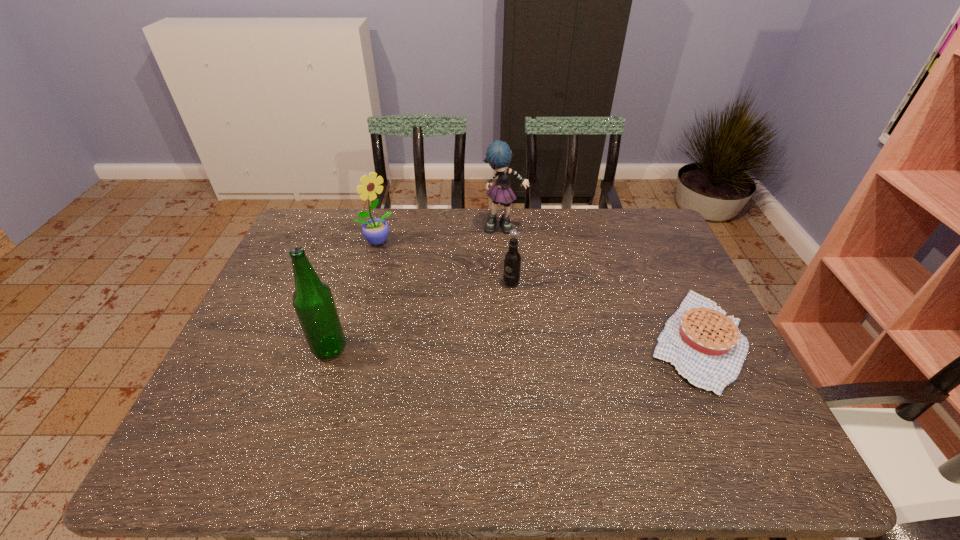
This screenshot has height=540, width=960. Find the location of `vacant space located 0.130m on the front-facing side of the rag doll`. vacant space located 0.130m on the front-facing side of the rag doll is located at coordinates (516, 261).

Find the location of a particular element. The image size is (960, 540). free region located on the front-facing side of the rag doll is located at coordinates (528, 302).

Locate an element on the screen. This screenshot has width=960, height=540. free space located 0.050m on the front-facing side of the rag doll is located at coordinates (511, 245).

This screenshot has width=960, height=540. Find the location of `blank space located 0.150m on the label of the second shortest object`. blank space located 0.150m on the label of the second shortest object is located at coordinates coord(487,323).

At what (x,y) coordinates should I click in order to perform the action: click on free space located 0.180m on the label of the second shortest object. Please return your answer as a coordinate pair (x, y). The image size is (960, 540). Looking at the image, I should click on (482, 330).

Find the location of a particular element. The image size is (960, 540). vacant space located on the label of the second shortest object is located at coordinates (484, 328).

Identify the location of vacant space located on the front-facing side of the sunflower. (420, 274).

You are a GUI agent. You are given a task and a screenshot of the screen. Output one action in this format:
    pyautogui.click(x=<x>, y=<y>)
    Task: Click on the vacant space situated 0.160m on the front-facing side of the sunflower
    The image size is (960, 540).
    Given the screenshot: What is the action you would take?
    pyautogui.click(x=417, y=271)

This screenshot has width=960, height=540. I want to click on free region located on the front-facing side of the sunflower, so click(433, 285).

This screenshot has width=960, height=540. I want to click on rag doll that is at the far edge, so click(498, 155).